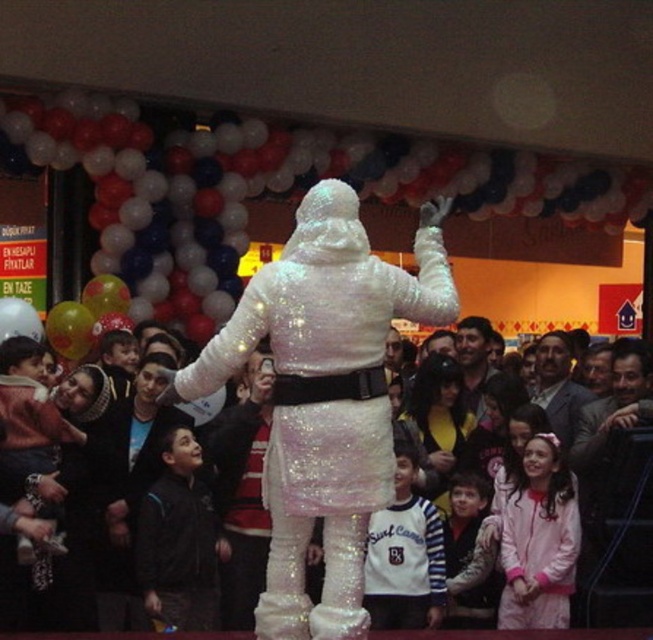
Is dark blue jacket at lower left positioned at the back of striped sweater at center?

No, it is in front of striped sweater at center.

Can you confirm if dark blue jacket at lower left is positioned below striped sweater at center?

Actually, dark blue jacket at lower left is above striped sweater at center.

You are a GUI agent. You are given a task and a screenshot of the screen. Output one action in this format:
    pyautogui.click(x=<x>, y=<y>)
    Task: Click on the dark blue jacket at lower left
    This screenshot has width=653, height=640.
    Given the screenshot: What is the action you would take?
    pyautogui.click(x=180, y=541)

Does white glossy balloon at center have a larger size compared to glittery sequined santa at center?

Correct, white glossy balloon at center is larger in size than glittery sequined santa at center.

Does point (144, 154) lie behind point (342, 433)?

That is True.

Where is `white glossy balloon at center`? This screenshot has height=640, width=653. white glossy balloon at center is located at coordinates (289, 186).

Is white sequined costume at center above smooth brown hair at center?

Incorrect, white sequined costume at center is not positioned above smooth brown hair at center.

Describe the element at coordinates (537, 557) in the screenshot. I see `white sequined costume at center` at that location.

Image resolution: width=653 pixels, height=640 pixels. Identify the location of white sequined costume at center. (537, 557).